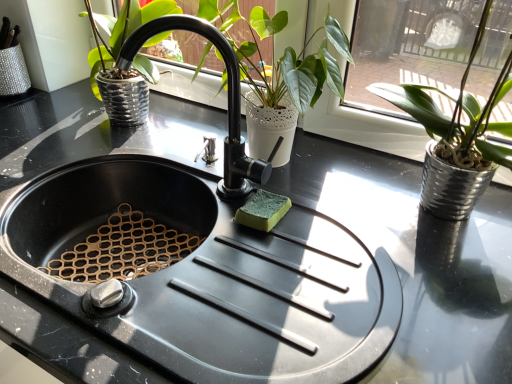
Question: In which direction should I rotate to look at white textured pot at center, which is the first houseplant in left-to-right order?

Choices:
 (A) right
 (B) left

Answer: (A)

Question: Can you confirm if silver metallic pot at right, the first houseplant from the right, is shorter than black matte faucet at center?

Choices:
 (A) no
 (B) yes

Answer: (A)

Question: Is silver metallic pot at right, arranged as the 2th houseplant when viewed from the left, positioned beyond the bounds of black matte faucet at center?

Choices:
 (A) yes
 (B) no

Answer: (A)

Question: From a real-world perspective, is silver metallic pot at right, arranged as the 2th houseplant when viewed from the left, positioned over black matte faucet at center based on gravity?

Choices:
 (A) yes
 (B) no

Answer: (A)

Question: Does silver metallic pot at right, the first houseplant from the right, have a smaller size compared to black matte faucet at center?

Choices:
 (A) no
 (B) yes

Answer: (A)

Question: Is silver metallic pot at right, arranged as the 2th houseplant when viewed from the left, not near black matte faucet at center?

Choices:
 (A) no
 (B) yes

Answer: (A)

Question: Could you tell me if silver metallic pot at right, the first houseplant from the right, is turned towards black matte faucet at center?

Choices:
 (A) yes
 (B) no

Answer: (B)

Question: Can you see black matte faucet at center touching silver metallic pot at right, the first houseplant from the right?

Choices:
 (A) no
 (B) yes

Answer: (A)

Question: Is the position of black matte faucet at center more distant than that of silver metallic pot at right, arranged as the 2th houseplant when viewed from the left?

Choices:
 (A) yes
 (B) no

Answer: (A)

Question: Considering the relative sizes of black matte faucet at center and silver metallic pot at right, arranged as the 2th houseplant when viewed from the left, in the image provided, is black matte faucet at center shorter than silver metallic pot at right, arranged as the 2th houseplant when viewed from the left,?

Choices:
 (A) yes
 (B) no

Answer: (A)

Question: Can you confirm if black matte faucet at center is taller than silver metallic pot at right, arranged as the 2th houseplant when viewed from the left?

Choices:
 (A) no
 (B) yes

Answer: (A)

Question: Does black matte faucet at center contain silver metallic pot at right, arranged as the 2th houseplant when viewed from the left?

Choices:
 (A) yes
 (B) no

Answer: (B)

Question: From a real-world perspective, is black matte faucet at center positioned over silver metallic pot at right, the first houseplant from the right, based on gravity?

Choices:
 (A) yes
 (B) no

Answer: (B)

Question: Is black matte faucet at center taller than white textured pot at center, acting as the 2th houseplant starting from the right?

Choices:
 (A) yes
 (B) no

Answer: (B)